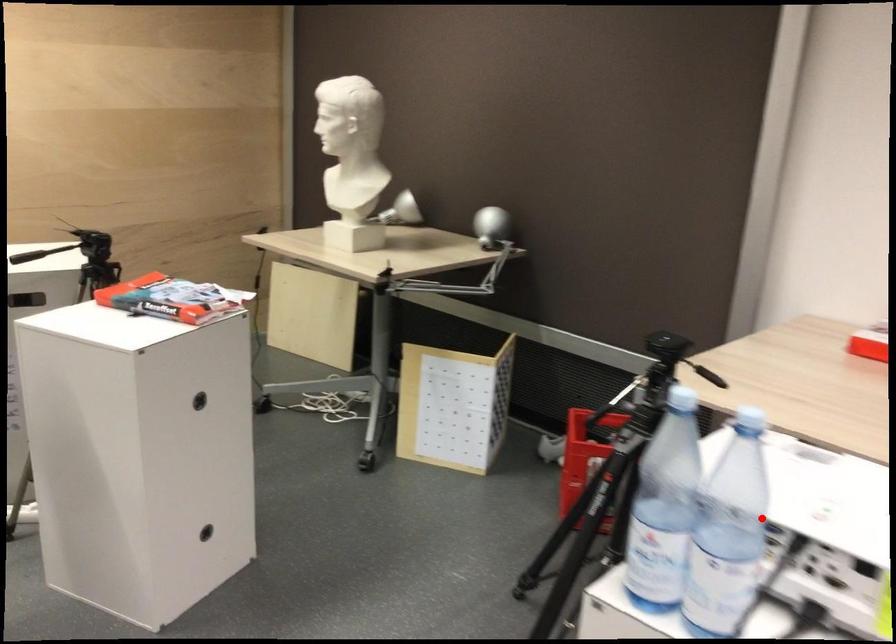
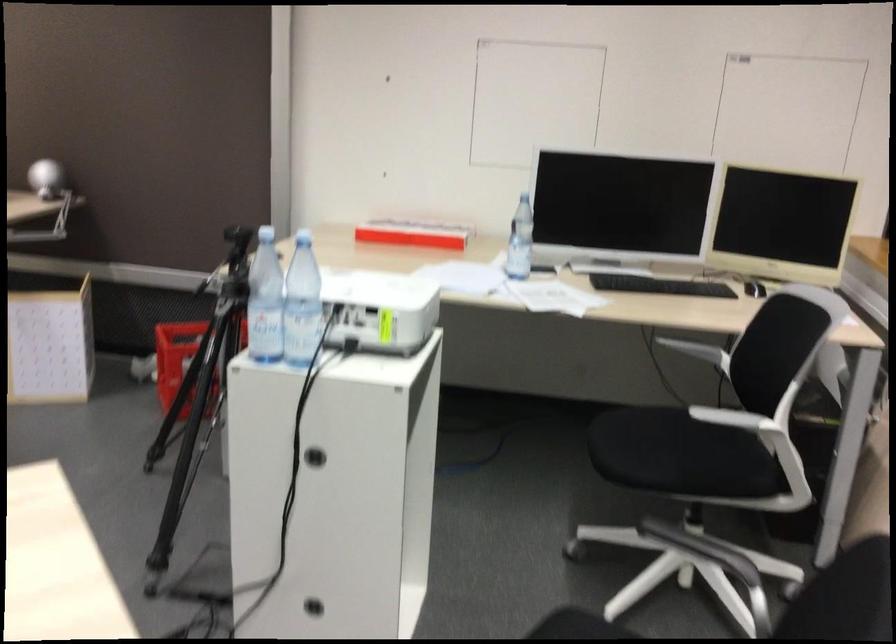
In the second image, find the point that corresponds to the highlighted location in the first image.

(302, 303)